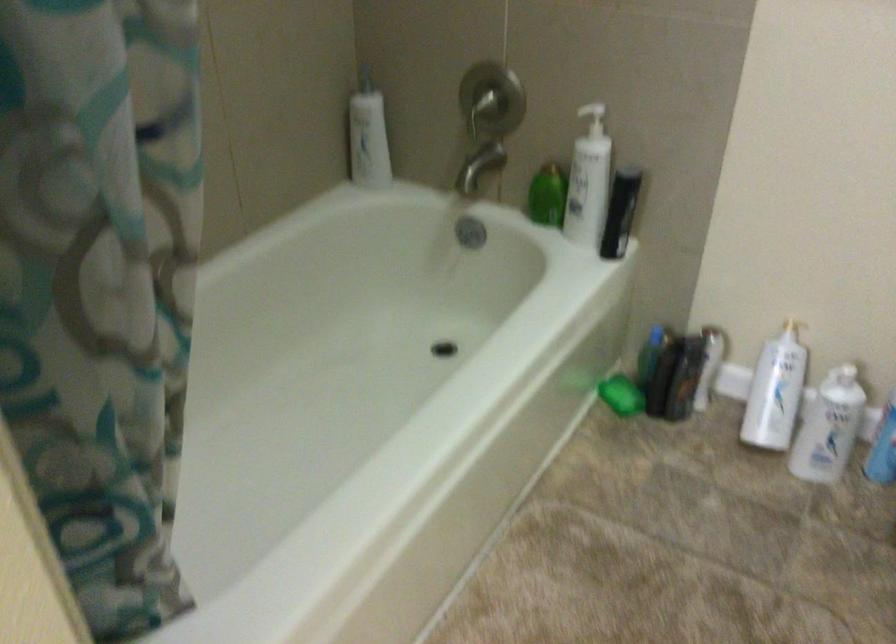
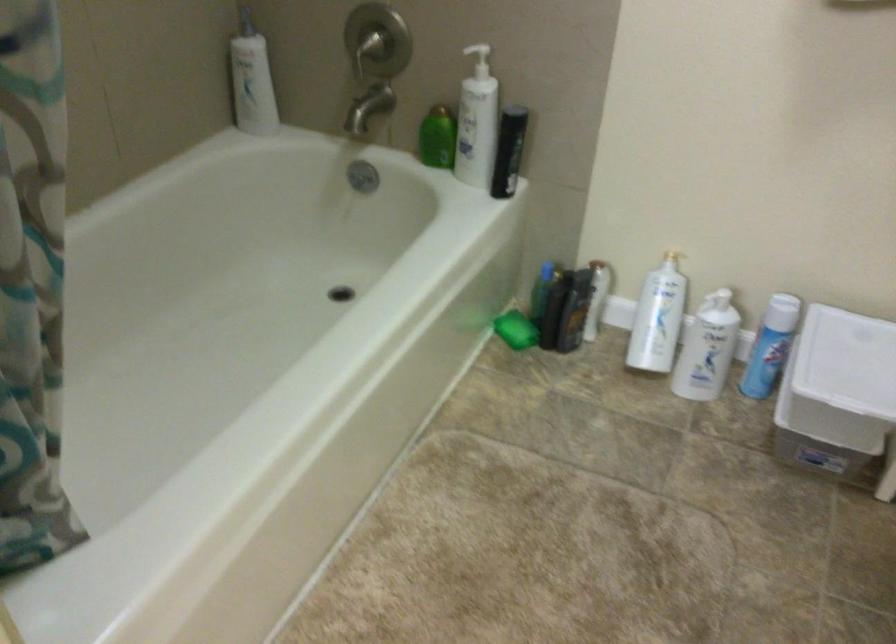
Locate, in the second image, the point that corresponds to (x=469, y=236) in the first image.

(362, 176)